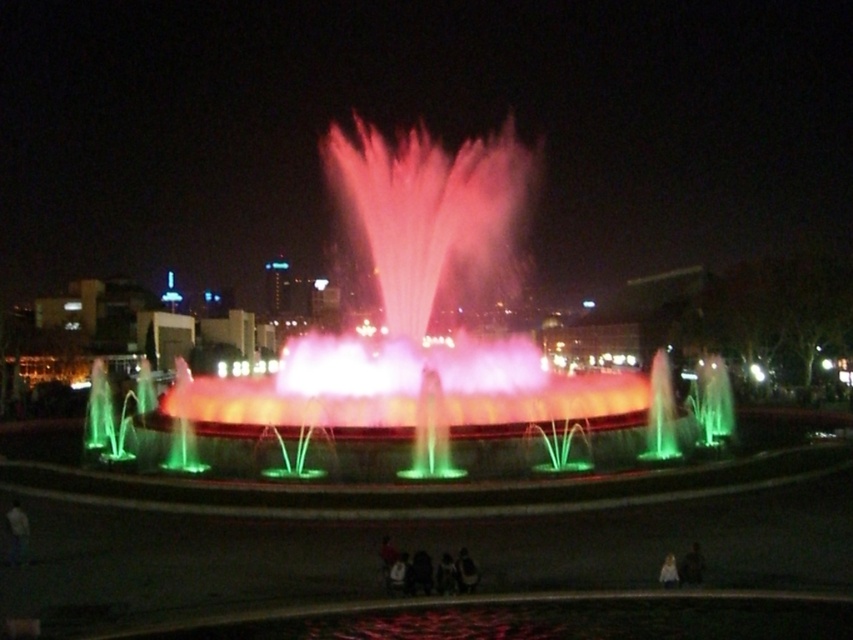
Question: Does illuminated water at center lie in front of light brown leather jacket at lower right?

Choices:
 (A) yes
 (B) no

Answer: (B)

Question: Is illuminated water at center smaller than light brown leather jacket at lower right?

Choices:
 (A) no
 (B) yes

Answer: (A)

Question: Does illuminated water at center have a lesser width compared to light brown leather jacket at lower right?

Choices:
 (A) yes
 (B) no

Answer: (B)

Question: Which point is closer to the camera?

Choices:
 (A) light brown leather jacket at lower right
 (B) illuminated water at center

Answer: (A)